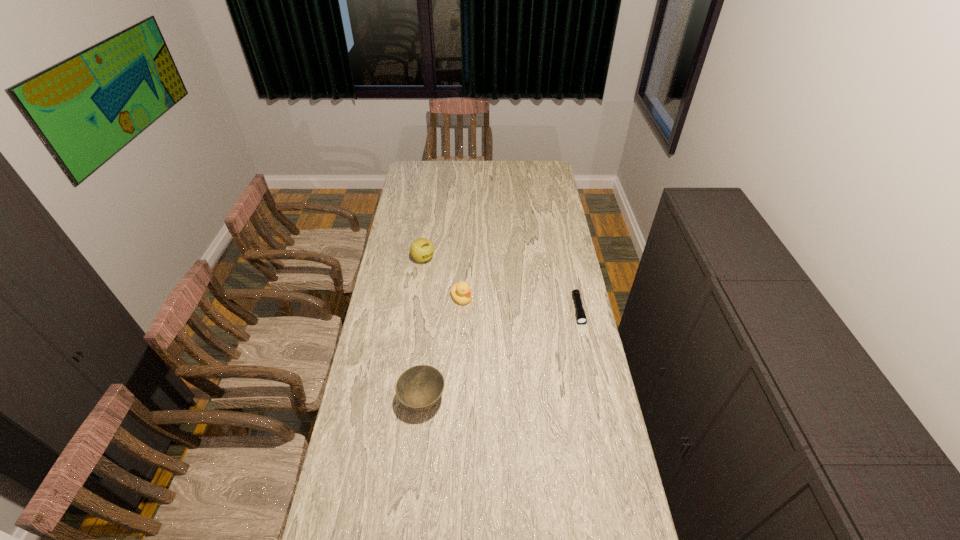
Find the location of `the nearest object`. the nearest object is located at coordinates (419, 387).

Locate an element on the screen. This screenshot has height=540, width=960. the shortest object is located at coordinates (581, 318).

Identify the location of the rightmost object. (581, 318).

What are the coordinates of `softball` in the screenshot? It's located at (422, 249).

Find the location of `duckling`. duckling is located at coordinates click(x=461, y=293).

The image size is (960, 540). Identify the location of vacant space situated on the front of the nearest object. (418, 449).

Where is `blank space located at the lens end of the flashlight`? This screenshot has height=540, width=960. blank space located at the lens end of the flashlight is located at coordinates (594, 386).

In order to click on vacant area situated 0.230m on the logo side of the farthest object in this screenshot , I will do `click(460, 292)`.

Where is `free space located 0.370m on the logo side of the farthest object`? free space located 0.370m on the logo side of the farthest object is located at coordinates (480, 310).

Identify the location of vacant space situated on the logo side of the farthest object. (450, 283).